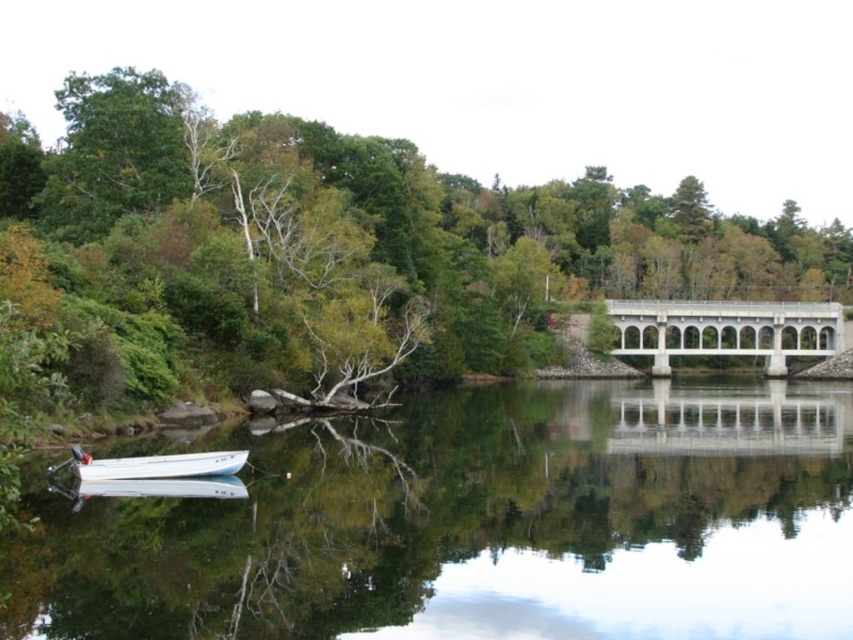
Question: Does green leafy tree at center appear on the left side of white glossy boat at lower left?

Choices:
 (A) yes
 (B) no

Answer: (B)

Question: Which point is farther to the camera?

Choices:
 (A) white concrete bridge at center
 (B) white glossy boat at lower left

Answer: (A)

Question: Is clear glass water at center in front of white glossy boat at lower left?

Choices:
 (A) yes
 (B) no

Answer: (A)

Question: Which point is farther to the camera?

Choices:
 (A) clear glass water at center
 (B) white concrete bridge at center
 (C) white glossy boat at lower left

Answer: (B)

Question: Does clear glass water at center appear on the left side of green leafy tree at center?

Choices:
 (A) yes
 (B) no

Answer: (A)

Question: Based on their relative distances, which object is farther from the clear glass water at center?

Choices:
 (A) white glossy boat at lower left
 (B) green leafy tree at center
 (C) white concrete bridge at center

Answer: (C)